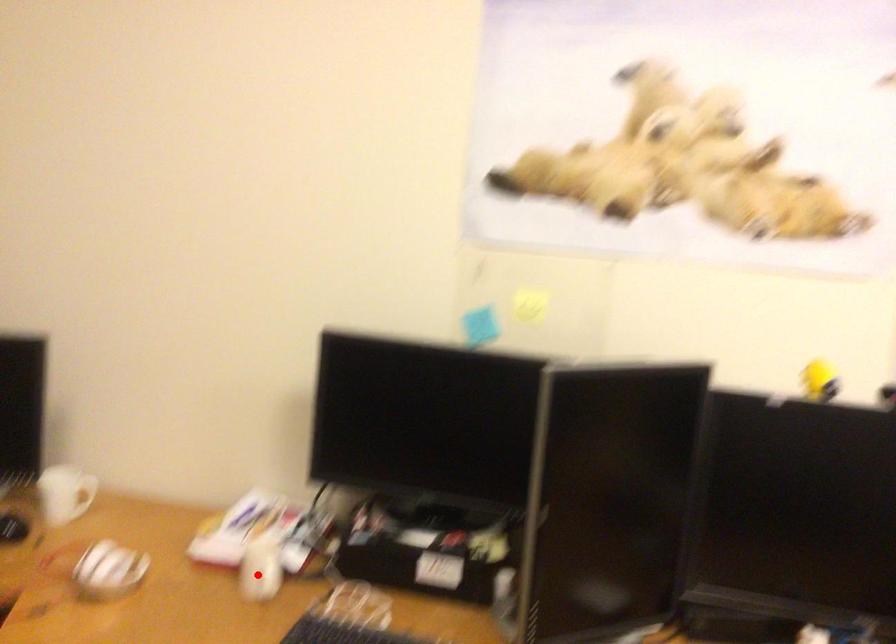
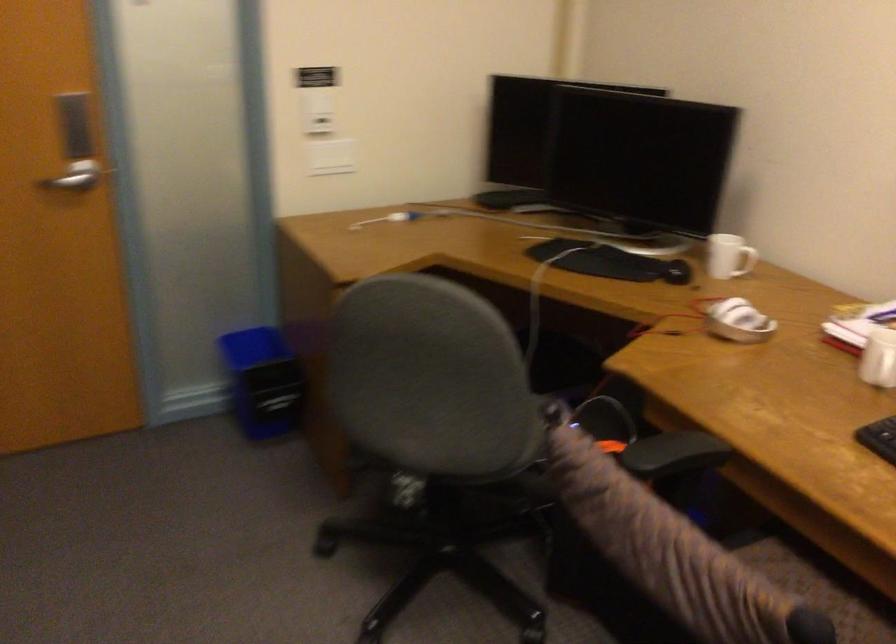
In the second image, find the point that corresponds to the highlighted location in the first image.

(879, 363)